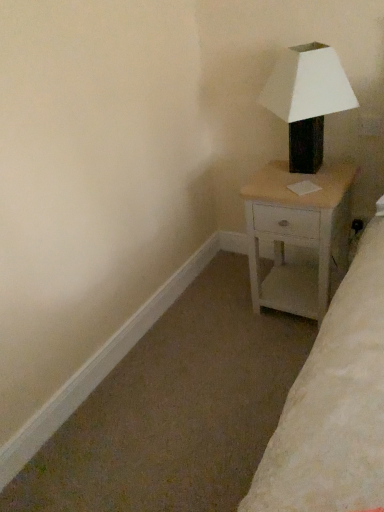
Question: Is white wood nightstand at right situated inside matte black lamp at upper right or outside?

Choices:
 (A) outside
 (B) inside

Answer: (A)

Question: From the image's perspective, is white wood nightstand at right positioned above or below matte black lamp at upper right?

Choices:
 (A) above
 (B) below

Answer: (B)

Question: Is white wood nightstand at right taller or shorter than matte black lamp at upper right?

Choices:
 (A) short
 (B) tall

Answer: (B)

Question: Does point (291, 159) appear closer or farther from the camera than point (286, 309)?

Choices:
 (A) farther
 (B) closer

Answer: (B)

Question: From a real-world perspective, is matte black lamp at upper right above or below white wood nightstand at right?

Choices:
 (A) below
 (B) above

Answer: (B)

Question: Is matte black lamp at upper right wider or thinner than white wood nightstand at right?

Choices:
 (A) wide
 (B) thin

Answer: (B)

Question: Choose the correct answer: Is matte black lamp at upper right inside white wood nightstand at right or outside it?

Choices:
 (A) outside
 (B) inside

Answer: (A)